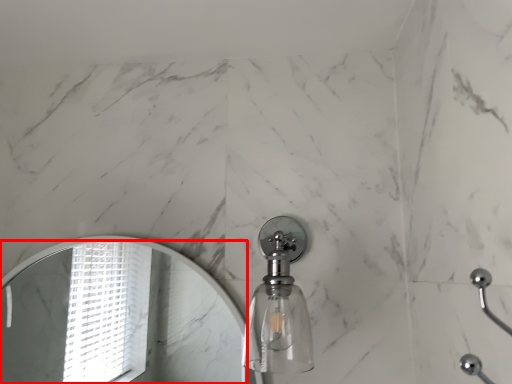
Question: Observing the image, what is the correct spatial positioning of mirror (annotated by the red box) in reference to soap dispenser?

Choices:
 (A) right
 (B) left

Answer: (B)